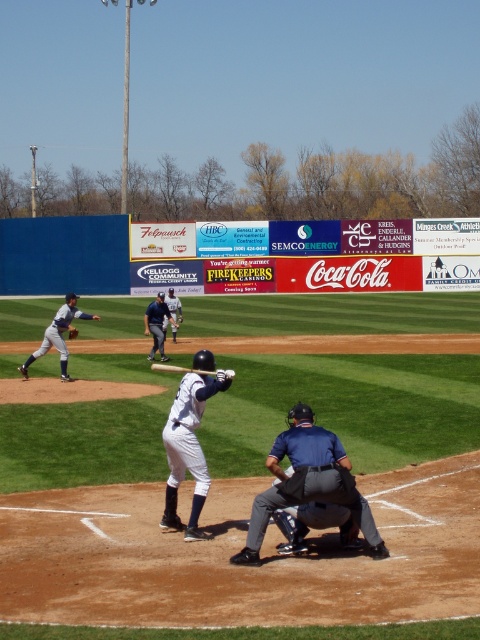
Does white matte uniform at center have a larger size compared to white uniform bat at center?

No.

Can you confirm if white matte uniform at center is positioned to the right of white uniform bat at center?

Correct, you'll find white matte uniform at center to the right of white uniform bat at center.

In order to click on white matte uniform at center in this screenshot , I will do `click(189, 449)`.

Find the location of a particular element. This screenshot has width=480, height=640. white matte uniform at center is located at coordinates pos(189,449).

Between point (262, 534) and point (72, 301), which one is positioned in front?

Point (262, 534) is more forward.

Between point (265, 506) and point (59, 310), which one is positioned behind?

The point (59, 310) is more distant.

Find the location of a particular element. The width and height of the screenshot is (480, 640). blue fabric umpire at center is located at coordinates (308, 483).

Is the position of blue fabric umpire at center more distant than that of white matte uniform at center?

No, blue fabric umpire at center is in front of white matte uniform at center.

Is point (301, 440) less distant than point (205, 369)?

Yes, point (301, 440) is in front of point (205, 369).

Locate an element on the screen. This screenshot has height=640, width=480. blue fabric umpire at center is located at coordinates (308, 483).